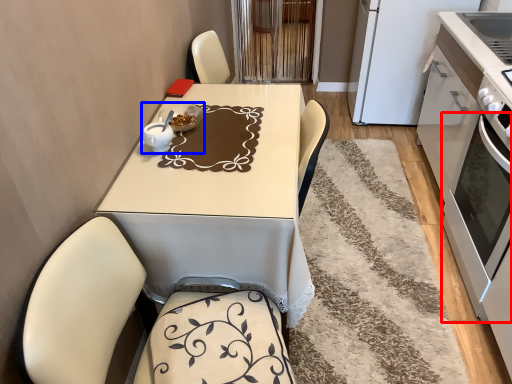
Question: Which of the following is the farthest to the observer, oven (highlighted by a red box) or tableware (highlighted by a blue box)?

Choices:
 (A) oven
 (B) tableware

Answer: (B)